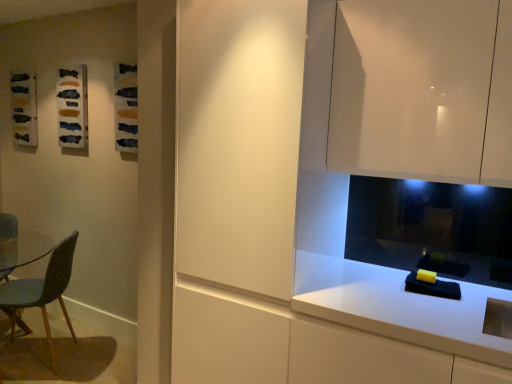
At what (x,y) coordinates should I click in order to perform the action: click on vacant point to the right of blue fabric chair at left. Please return your answer as a coordinate pair (x, y). The image size is (512, 384). Looking at the image, I should click on (100, 354).